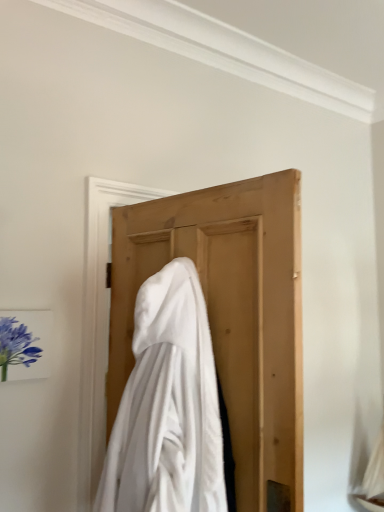
Question: Does matte purple flower at left turn towards white soft cloth at center?

Choices:
 (A) no
 (B) yes

Answer: (B)

Question: Is matte purple flower at left located outside white soft cloth at center?

Choices:
 (A) no
 (B) yes

Answer: (B)

Question: From a real-world perspective, is matte purple flower at left physically below white soft cloth at center?

Choices:
 (A) yes
 (B) no

Answer: (B)

Question: From a real-world perspective, is matte purple flower at left on white soft cloth at center?

Choices:
 (A) no
 (B) yes

Answer: (B)

Question: From the image's perspective, is matte purple flower at left below white soft cloth at center?

Choices:
 (A) yes
 (B) no

Answer: (B)

Question: Is the position of matte purple flower at left less distant than that of white soft cloth at center?

Choices:
 (A) no
 (B) yes

Answer: (A)

Question: Is white soft cloth at center oriented away from matte purple flower at left?

Choices:
 (A) no
 (B) yes

Answer: (A)

Question: From the image's perspective, is white soft cloth at center above matte purple flower at left?

Choices:
 (A) no
 (B) yes

Answer: (A)

Question: Is white soft cloth at center shorter than matte purple flower at left?

Choices:
 (A) yes
 (B) no

Answer: (B)

Question: Considering the relative sizes of white soft cloth at center and matte purple flower at left in the image provided, is white soft cloth at center taller than matte purple flower at left?

Choices:
 (A) yes
 (B) no

Answer: (A)

Question: From the image's perspective, is white soft cloth at center located beneath matte purple flower at left?

Choices:
 (A) no
 (B) yes

Answer: (B)

Question: From a real-world perspective, does white soft cloth at center stand above matte purple flower at left?

Choices:
 (A) yes
 (B) no

Answer: (B)

Question: Based on their sizes in the image, would you say matte purple flower at left is bigger or smaller than white soft cloth at center?

Choices:
 (A) big
 (B) small

Answer: (B)